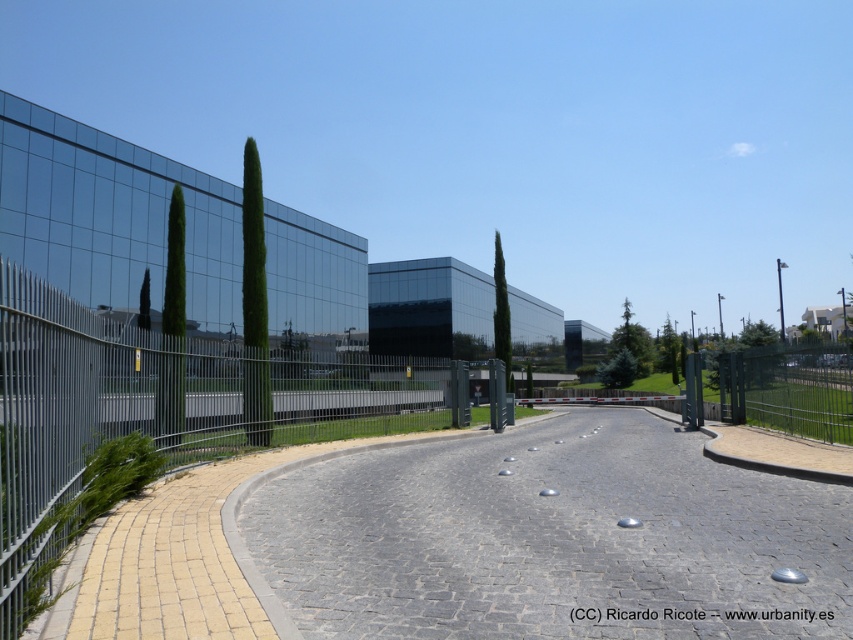
You are a delivery person approaching the building and need to place a package on the gray cobblestone pavement at center. However, there is a green glossy cypress tree at center in the way. Can you easily access the pavement to place the package?

The gray cobblestone pavement at center is closer to the viewer than the green glossy cypress tree at center, so you can easily access the pavement to place the package as the tree is behind it.

Consider the image. You are standing in front of the building and want to walk from point A to point B. Point A is at coordinate point (248,218) and point B is at coordinate point (167,408). Which point is closer to you when you start walking?

Point A at coordinate point (248,218) is closer to you because it is further to the viewer than point B at coordinate point (167,408), meaning it is nearer in your line of sight.